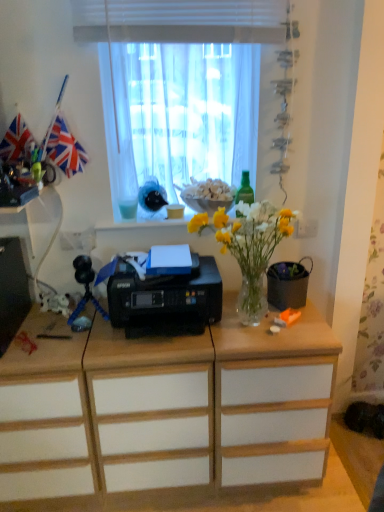
Question: Is white sheer curtain at upper center oriented away from green glass bottle at upper center?

Choices:
 (A) no
 (B) yes

Answer: (A)

Question: Can you confirm if white sheer curtain at upper center is wider than green glass bottle at upper center?

Choices:
 (A) no
 (B) yes

Answer: (B)

Question: Does white sheer curtain at upper center have a lesser height compared to green glass bottle at upper center?

Choices:
 (A) no
 (B) yes

Answer: (A)

Question: From a real-world perspective, is white sheer curtain at upper center physically below green glass bottle at upper center?

Choices:
 (A) no
 (B) yes

Answer: (A)

Question: Can you see white sheer curtain at upper center touching green glass bottle at upper center?

Choices:
 (A) no
 (B) yes

Answer: (A)

Question: Looking at the image, does red fabric flag at upper left seem bigger or smaller compared to white wood drawer at center, the second drawer from the right?

Choices:
 (A) big
 (B) small

Answer: (B)

Question: Based on their positions, is red fabric flag at upper left located to the left or right of white wood drawer at center, which is counted as the first drawer, starting from the left?

Choices:
 (A) right
 (B) left

Answer: (A)

Question: In terms of width, does red fabric flag at upper left look wider or thinner when compared to white wood drawer at center, which is counted as the first drawer, starting from the left?

Choices:
 (A) wide
 (B) thin

Answer: (B)

Question: Considering their positions, is red fabric flag at upper left located in front of or behind white wood drawer at center, the second drawer from the right?

Choices:
 (A) front
 (B) behind

Answer: (B)

Question: Relative to translucent glass vase at center, is white wood drawer at center, the second drawer from the right, in front or behind?

Choices:
 (A) behind
 (B) front

Answer: (A)

Question: In the image, is white wood drawer at center, the second drawer from the right, on the left side or the right side of translucent glass vase at center?

Choices:
 (A) right
 (B) left

Answer: (B)

Question: Considering the positions of white wood drawer at center, the second drawer from the right, and translucent glass vase at center in the image, is white wood drawer at center, the second drawer from the right, wider or thinner than translucent glass vase at center?

Choices:
 (A) thin
 (B) wide

Answer: (B)

Question: Do you think white wood drawer at center, the second drawer from the right, is within translucent glass vase at center, or outside of it?

Choices:
 (A) outside
 (B) inside

Answer: (A)

Question: Looking at their shapes, would you say black plastic printer at center is wider or thinner than green glass bottle at upper center?

Choices:
 (A) wide
 (B) thin

Answer: (A)

Question: From a real-world perspective, is black plastic printer at center physically located above or below green glass bottle at upper center?

Choices:
 (A) below
 (B) above

Answer: (A)